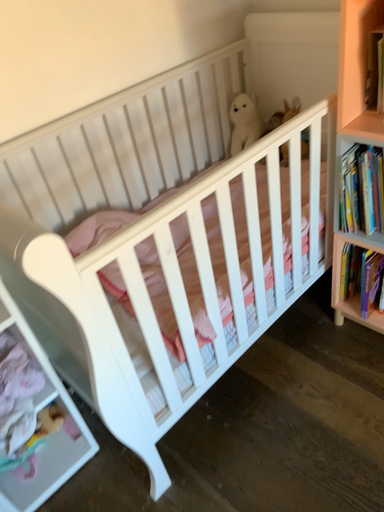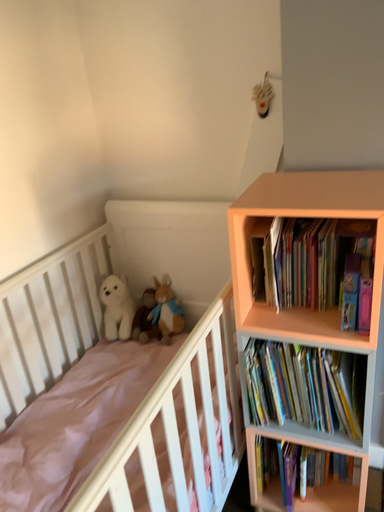
Question: How did the camera likely rotate when shooting the video?

Choices:
 (A) rotated upward
 (B) rotated downward

Answer: (A)